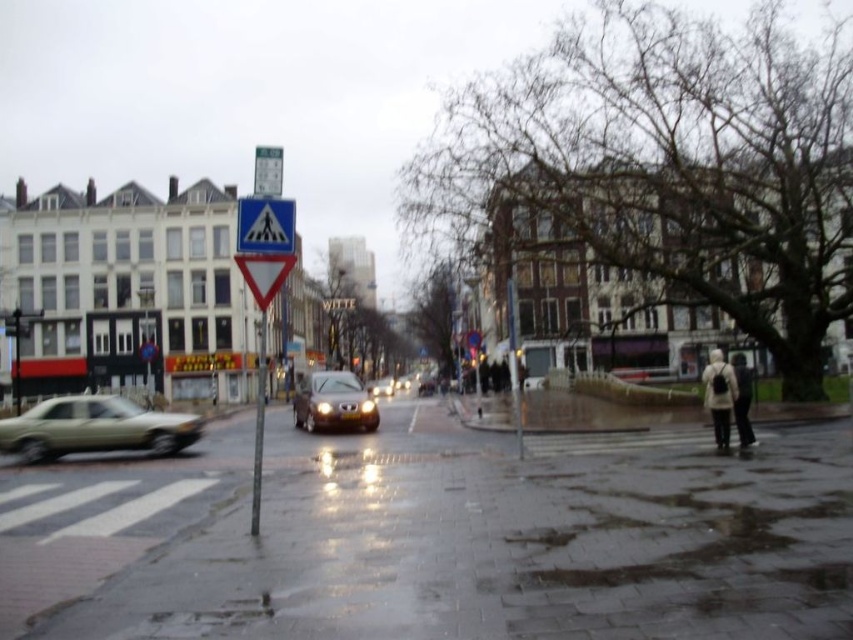
You are a delivery person trying to navigate through the wet street. You see the blue plastic pedestrian crossing sign at left and the shiny brown car at center. Which object appears bigger in the scene?

The blue plastic pedestrian crossing sign at left appears bigger than the shiny brown car at center because it has a larger size.

You are a delivery robot with a 2 meter wide package. You need to move from the wet concrete pavement at lower center to the metallic reflective yield sign at center. Is there enough space for your package between these two objects?

The distance between the wet concrete pavement at lower center and the metallic reflective yield sign at center is 8.73 meters. Since your package is only 2 meters wide, there is sufficient space to move it between them as the distance is greater than the package width.